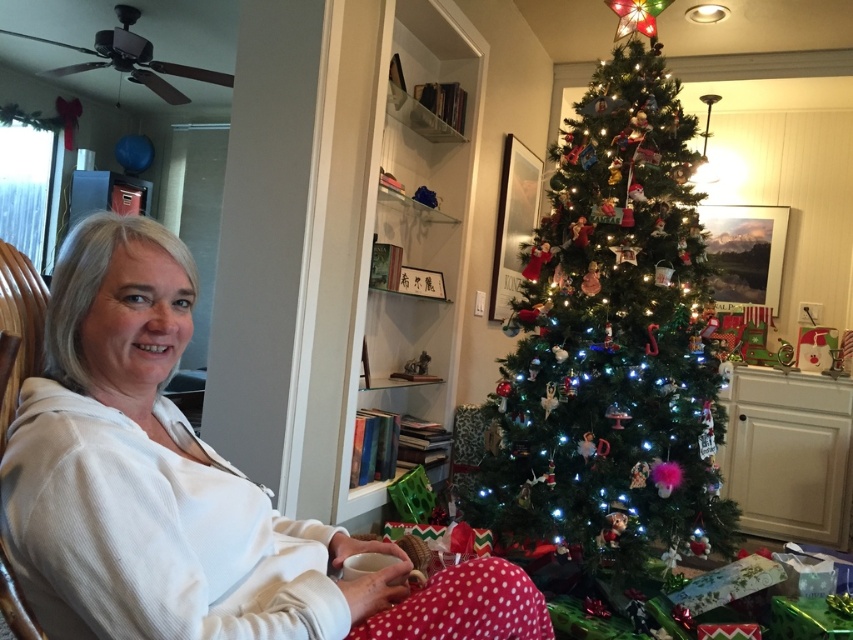
Is the position of white soft sweater at center less distant than that of green matte christmas tree at center?

Yes.

Is white soft sweater at center above green matte christmas tree at center?

No, white soft sweater at center is not above green matte christmas tree at center.

Where is `white soft sweater at center`? This screenshot has width=853, height=640. white soft sweater at center is located at coordinates (186, 490).